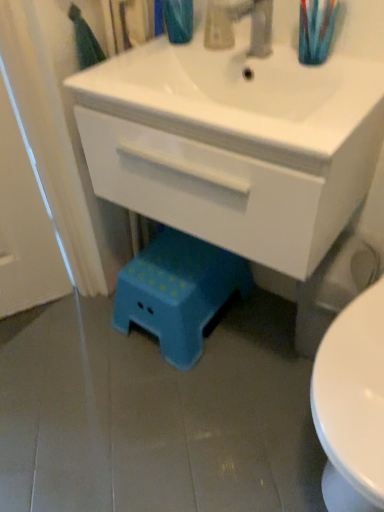
Find the location of a particular element. free space to the right of blue plastic step stool at lower center is located at coordinates (263, 334).